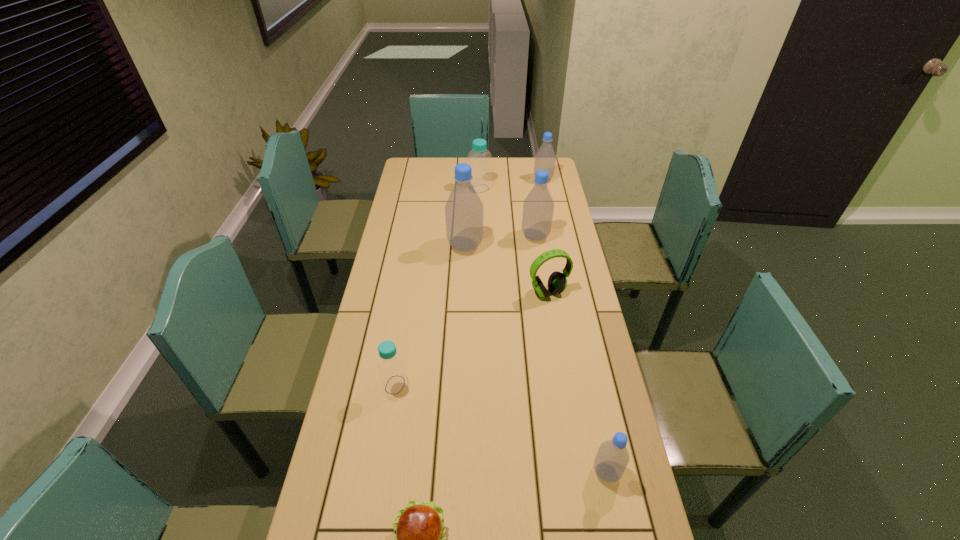
Where is `object that is at the far edge`? object that is at the far edge is located at coordinates (545, 158).

Locate an element on the screen. This screenshot has width=960, height=540. object present at the left edge is located at coordinates (393, 377).

Identify the location of headset that is at the right edge. The width and height of the screenshot is (960, 540). (557, 282).

Locate an element on the screen. The image size is (960, 540). object at the far right corner is located at coordinates (545, 158).

Identify the location of vacant space at the far edge of the desktop. (446, 168).

The image size is (960, 540). I want to click on free space at the left edge of the desktop, so click(411, 219).

You are a GUI agent. You are given a task and a screenshot of the screen. Output one action in this format:
    pyautogui.click(x=<x>, y=<y>)
    Task: Click on the vacant space at the right edge of the desktop
    
    Given the screenshot: What is the action you would take?
    pyautogui.click(x=567, y=298)

This screenshot has width=960, height=540. I want to click on vacant space at the far left corner of the desktop, so click(425, 168).

Where is `free region at the far right corner of the desktop`? free region at the far right corner of the desktop is located at coordinates (527, 160).

At what (x,y) coordinates should I click in order to perform the action: click on vacant point located between the headset and the tallest object. Please return your answer as a coordinate pair (x, y). Looking at the image, I should click on (507, 269).